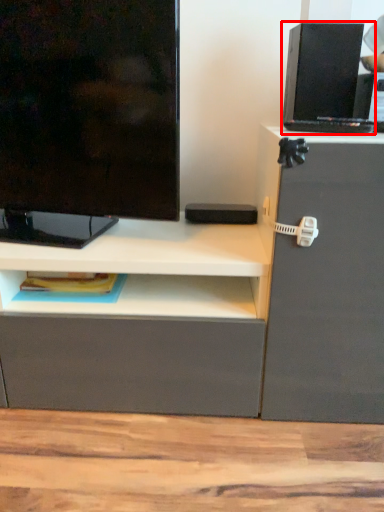
Question: Where is computer (annotated by the red box) located in relation to television in the image?

Choices:
 (A) right
 (B) left

Answer: (A)